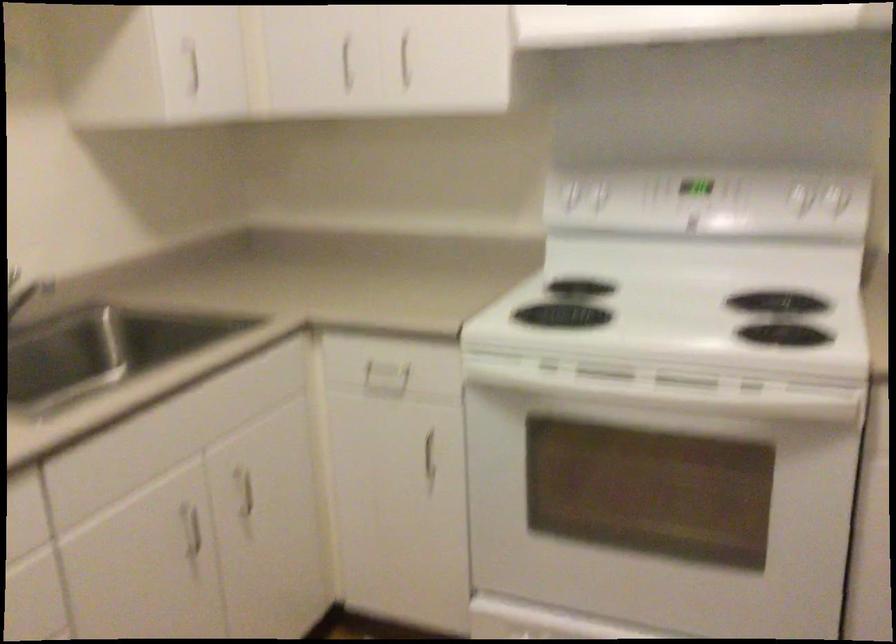
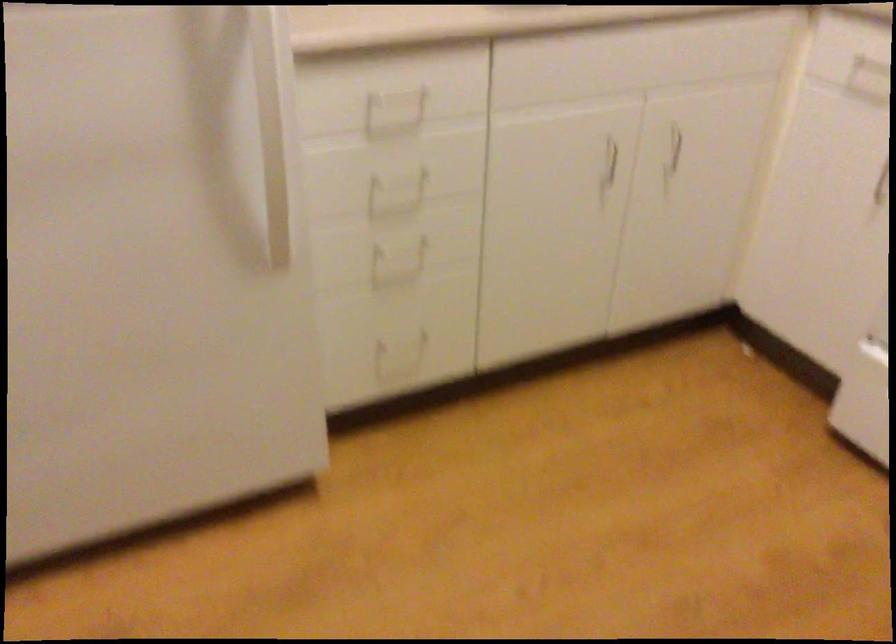
Where in the second image is the point corresponding to [244,494] from the first image?

(675, 147)